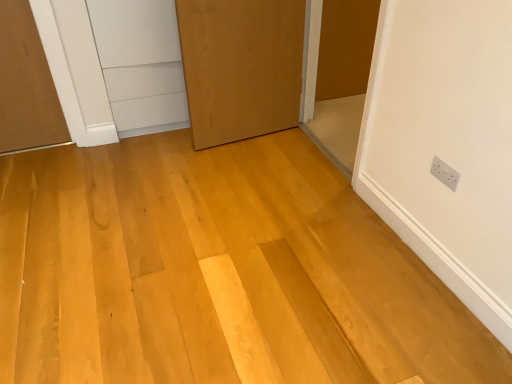
What do you see at coordinates (217, 272) in the screenshot?
I see `natural wood floor at center` at bounding box center [217, 272].

The height and width of the screenshot is (384, 512). Describe the element at coordinates (445, 173) in the screenshot. I see `white plastic electric outlet at upper right` at that location.

What are the coordinates of `natural wood floor at center` in the screenshot? It's located at pos(217,272).

Is wooden door at center, arranged as the 2th door when viewed from the right, far away from matte brown door at upper right, which is counted as the first door, starting from the right?

No, wooden door at center, arranged as the 2th door when viewed from the right, is in close proximity to matte brown door at upper right, which is counted as the first door, starting from the right.

Is wooden door at center, the 1th door when ordered from left to right, further to the viewer compared to matte brown door at upper right, which is counted as the first door, starting from the right?

No, wooden door at center, the 1th door when ordered from left to right, is in front of matte brown door at upper right, which is counted as the first door, starting from the right.

Could you tell me if wooden door at center, the 1th door when ordered from left to right, is facing matte brown door at upper right, which is the 2th door in left-to-right order?

No, wooden door at center, the 1th door when ordered from left to right, is not aimed at matte brown door at upper right, which is the 2th door in left-to-right order.

Between wooden door at center, the 1th door when ordered from left to right, and matte brown door at upper right, which is counted as the first door, starting from the right, which one has smaller size?

Smaller between the two is matte brown door at upper right, which is counted as the first door, starting from the right.

From the image's perspective, which one is positioned lower, natural wood floor at center or matte brown door at upper right, which is the 2th door in left-to-right order?

natural wood floor at center.

Looking at this image, is natural wood floor at center not close to matte brown door at upper right, which is the 2th door in left-to-right order?

Absolutely, natural wood floor at center is distant from matte brown door at upper right, which is the 2th door in left-to-right order.

Which point is more distant from viewer, (x=224, y=192) or (x=354, y=5)?

Point (x=354, y=5)

Is natural wood floor at center to the right of matte brown door at upper right, which is counted as the first door, starting from the right, from the viewer's perspective?

In fact, natural wood floor at center is to the left of matte brown door at upper right, which is counted as the first door, starting from the right.

Find the location of a particular element. This screenshot has height=384, width=512. door that is the 2nd one when counting leftward from the white plastic electric outlet at upper right is located at coordinates (241, 67).

Considering the positions of objects wooden door at center, arranged as the 2th door when viewed from the right, and white plastic electric outlet at upper right in the image provided, who is in front, wooden door at center, arranged as the 2th door when viewed from the right, or white plastic electric outlet at upper right?

white plastic electric outlet at upper right is more forward.

Could you measure the distance between wooden door at center, arranged as the 2th door when viewed from the right, and white plastic electric outlet at upper right?

The distance of wooden door at center, arranged as the 2th door when viewed from the right, from white plastic electric outlet at upper right is 4.44 feet.

From their relative heights in the image, would you say wooden door at center, arranged as the 2th door when viewed from the right, is taller or shorter than white plastic electric outlet at upper right?

In the image, wooden door at center, arranged as the 2th door when viewed from the right, appears to be taller than white plastic electric outlet at upper right.

How much distance is there between matte brown door at upper right, which is the 2th door in left-to-right order, and white plastic electric outlet at upper right?

5.51 feet.

Consider the image. Which is farther from the camera, (345, 64) or (445, 171)?

Positioned behind is point (345, 64).

Can you tell me how much matte brown door at upper right, which is counted as the first door, starting from the right, and white plastic electric outlet at upper right differ in facing direction?

matte brown door at upper right, which is counted as the first door, starting from the right, and white plastic electric outlet at upper right are facing 87.3 degrees away from each other.

Which of these two, matte brown door at upper right, which is counted as the first door, starting from the right, or white plastic electric outlet at upper right, is bigger?

With larger size is matte brown door at upper right, which is counted as the first door, starting from the right.

Considering the relative positions of matte brown door at upper right, which is counted as the first door, starting from the right, and wooden door at center, arranged as the 2th door when viewed from the right, in the image provided, is matte brown door at upper right, which is counted as the first door, starting from the right, to the left of wooden door at center, arranged as the 2th door when viewed from the right, from the viewer's perspective?

No.

Is matte brown door at upper right, which is the 2th door in left-to-right order, positioned beyond the bounds of wooden door at center, arranged as the 2th door when viewed from the right?

Indeed, matte brown door at upper right, which is the 2th door in left-to-right order, is completely outside wooden door at center, arranged as the 2th door when viewed from the right.

Considering the positions of point (320, 92) and point (194, 131), is point (320, 92) closer or farther from the camera than point (194, 131)?

Point (320, 92) is positioned farther from the camera compared to point (194, 131).

How much distance is there between matte brown door at upper right, which is counted as the first door, starting from the right, and wooden door at center, arranged as the 2th door when viewed from the right?

matte brown door at upper right, which is counted as the first door, starting from the right, is 25.64 inches away from wooden door at center, arranged as the 2th door when viewed from the right.

In the scene shown: Is wooden door at center, arranged as the 2th door when viewed from the right, at the back of white plastic electric outlet at upper right?

white plastic electric outlet at upper right does not have its back to wooden door at center, arranged as the 2th door when viewed from the right.

Is white plastic electric outlet at upper right wider than wooden door at center, arranged as the 2th door when viewed from the right?

No, white plastic electric outlet at upper right is not wider than wooden door at center, arranged as the 2th door when viewed from the right.

From the image's perspective, is white plastic electric outlet at upper right located above or below wooden door at center, the 1th door when ordered from left to right?

Clearly, from the image's perspective, white plastic electric outlet at upper right is below wooden door at center, the 1th door when ordered from left to right.

In terms of size, does white plastic electric outlet at upper right appear bigger or smaller than wooden door at center, arranged as the 2th door when viewed from the right?

In the image, white plastic electric outlet at upper right appears to be smaller than wooden door at center, arranged as the 2th door when viewed from the right.

Is natural wood floor at center taller than white plastic electric outlet at upper right?

No, natural wood floor at center is not taller than white plastic electric outlet at upper right.

Can you confirm if natural wood floor at center is bigger than white plastic electric outlet at upper right?

Yes, natural wood floor at center is bigger than white plastic electric outlet at upper right.

Can you tell me how much natural wood floor at center and white plastic electric outlet at upper right differ in facing direction?

The facing directions of natural wood floor at center and white plastic electric outlet at upper right are 90.4 degrees apart.

Is natural wood floor at center positioned with its back to white plastic electric outlet at upper right?

No, white plastic electric outlet at upper right is not at the back of natural wood floor at center.

There is a matte brown door at upper right, which is the 2th door in left-to-right order. Where is `door above it (from a real-world perspective)`? The width and height of the screenshot is (512, 384). door above it (from a real-world perspective) is located at coordinates (241, 67).

Find the location of a particular element. plywood that is under the matte brown door at upper right, which is counted as the first door, starting from the right (from a real-world perspective) is located at coordinates (217, 272).

Considering their positions, is matte brown door at upper right, which is the 2th door in left-to-right order, positioned further to natural wood floor at center than wooden door at center, arranged as the 2th door when viewed from the right?

matte brown door at upper right, which is the 2th door in left-to-right order, lies further to natural wood floor at center than the other object.

Looking at the image, which one is located closer to white plastic electric outlet at upper right, wooden door at center, the 1th door when ordered from left to right, or matte brown door at upper right, which is counted as the first door, starting from the right?

wooden door at center, the 1th door when ordered from left to right, lies closer to white plastic electric outlet at upper right than the other object.

Estimate the real-world distances between objects in this image. Which object is closer to wooden door at center, arranged as the 2th door when viewed from the right, natural wood floor at center or matte brown door at upper right, which is counted as the first door, starting from the right?

matte brown door at upper right, which is counted as the first door, starting from the right, is positioned closer to the anchor wooden door at center, arranged as the 2th door when viewed from the right.

When comparing their distances from white plastic electric outlet at upper right, does wooden door at center, the 1th door when ordered from left to right, or natural wood floor at center seem further?

Among the two, wooden door at center, the 1th door when ordered from left to right, is located further to white plastic electric outlet at upper right.

Based on their spatial positions, is wooden door at center, the 1th door when ordered from left to right, or natural wood floor at center closer to matte brown door at upper right, which is the 2th door in left-to-right order?

wooden door at center, the 1th door when ordered from left to right, is closer to matte brown door at upper right, which is the 2th door in left-to-right order.

From the image, which object appears to be farther from natural wood floor at center, white plastic electric outlet at upper right or wooden door at center, arranged as the 2th door when viewed from the right?

The object further to natural wood floor at center is white plastic electric outlet at upper right.

Estimate the real-world distances between objects in this image. Which object is further from white plastic electric outlet at upper right, matte brown door at upper right, which is the 2th door in left-to-right order, or natural wood floor at center?

Based on the image, matte brown door at upper right, which is the 2th door in left-to-right order, appears to be further to white plastic electric outlet at upper right.

In the scene shown: Considering their positions, is natural wood floor at center positioned closer to matte brown door at upper right, which is the 2th door in left-to-right order, than white plastic electric outlet at upper right?

Based on the image, natural wood floor at center appears to be nearer to matte brown door at upper right, which is the 2th door in left-to-right order.

Where is `door between natural wood floor at center and matte brown door at upper right, which is the 2th door in left-to-right order, from front to back`? The image size is (512, 384). door between natural wood floor at center and matte brown door at upper right, which is the 2th door in left-to-right order, from front to back is located at coordinates (241, 67).

Identify the location of electric outlet located between natural wood floor at center and wooden door at center, the 1th door when ordered from left to right, in the depth direction. (445, 173).

You are a GUI agent. You are given a task and a screenshot of the screen. Output one action in this format:
    pyautogui.click(x=<x>, y=<y>)
    Task: Click on the door between white plastic electric outlet at upper right and matte brown door at upper right, which is counted as the first door, starting from the right, from front to back
    This screenshot has height=384, width=512.
    Given the screenshot: What is the action you would take?
    click(241, 67)

Image resolution: width=512 pixels, height=384 pixels. In order to click on electric outlet positioned between natural wood floor at center and matte brown door at upper right, which is counted as the first door, starting from the right, from near to far in this screenshot , I will do `click(445, 173)`.